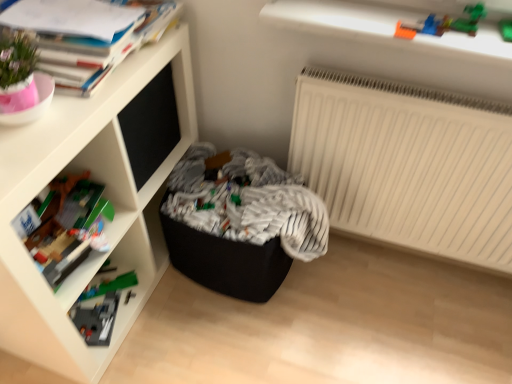
Locate an element on the screen. The image size is (512, 384). free location to the right of white matte shelf at upper left is located at coordinates (244, 327).